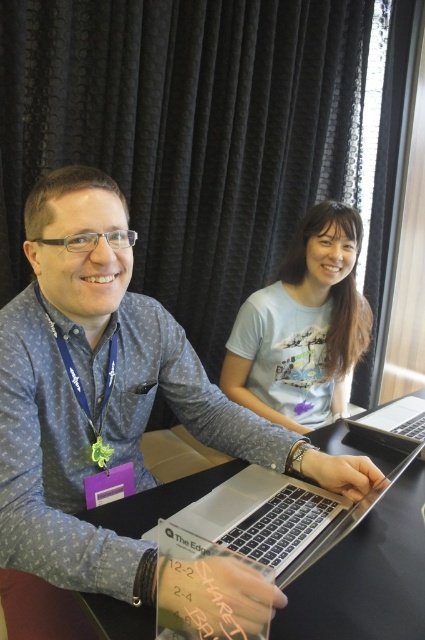
Is point (227, 422) less distant than point (322, 538)?

No, it is behind (322, 538).

Does point (0, 541) come in front of point (153, 632)?

No, (0, 541) is behind (153, 632).

Locate an element on the screen. matte blue shirt at center is located at coordinates (102, 410).

Which is more to the left, matte blue shirt at center or light blue cotton t-shirt at upper center?

Positioned to the left is matte blue shirt at center.

Based on the photo, is matte blue shirt at center to the left of light blue cotton t-shirt at upper center from the viewer's perspective?

Indeed, matte blue shirt at center is positioned on the left side of light blue cotton t-shirt at upper center.

This screenshot has width=425, height=640. What are the coordinates of `matte blue shirt at center` in the screenshot? It's located at (102, 410).

Find the location of a particular element. The height and width of the screenshot is (640, 425). matte blue shirt at center is located at coordinates (102, 410).

Which is below, black plastic table at center or light blue cotton t-shirt at upper center?

black plastic table at center is below.

Does black plastic table at center appear on the left side of light blue cotton t-shirt at upper center?

Indeed, black plastic table at center is positioned on the left side of light blue cotton t-shirt at upper center.

Identify the location of black plastic table at center. The height and width of the screenshot is (640, 425). (365, 576).